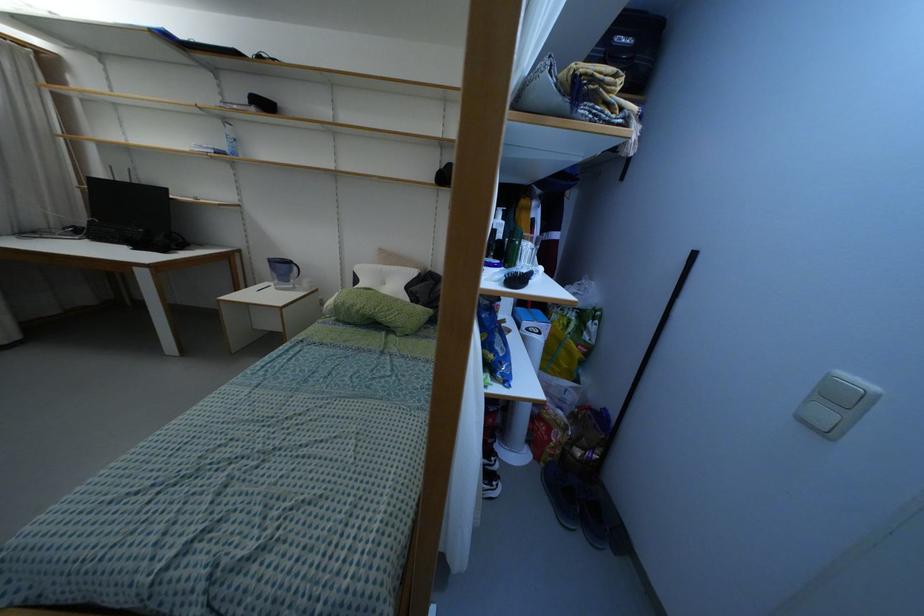
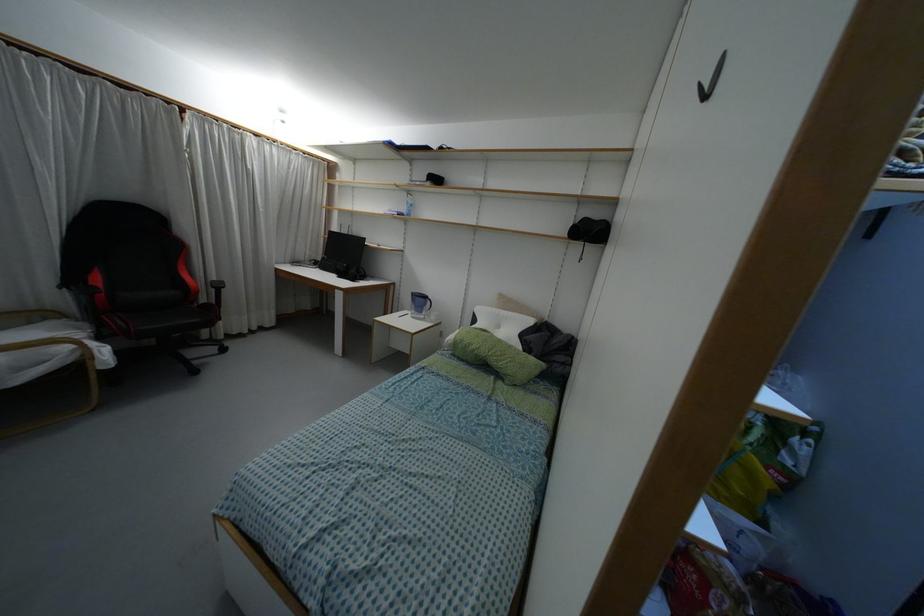
The point at [379,265] is marked in the first image. Where is the corresponding point in the second image?

(496, 310)